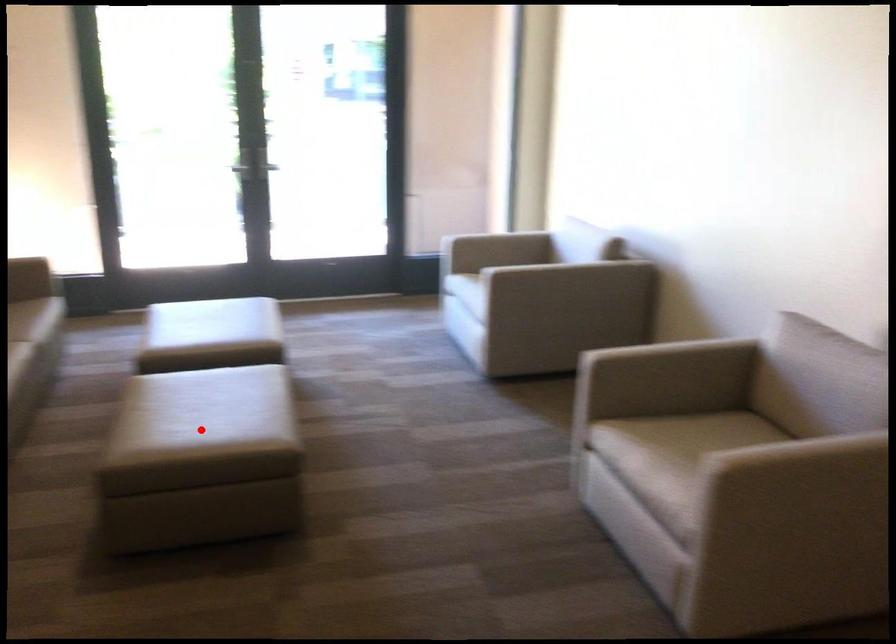
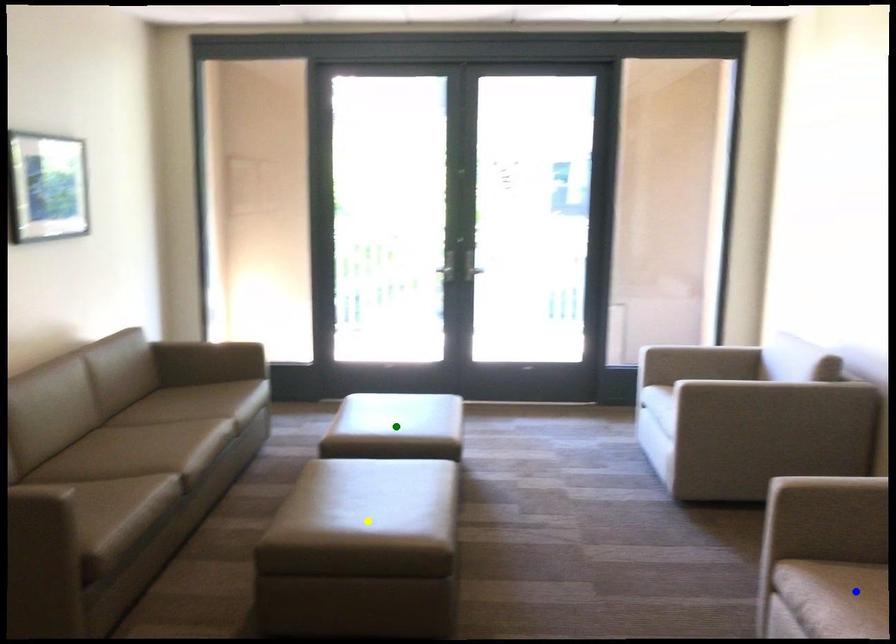
Question: I am providing you with two images of the same scene from different viewpoints. A red point is marked on the first image. You are given multiple points on the second image. Which spot in image 2 lines up with the point in image 1?

Choices:
 (A) blue point
 (B) yellow point
 (C) green point

Answer: (B)